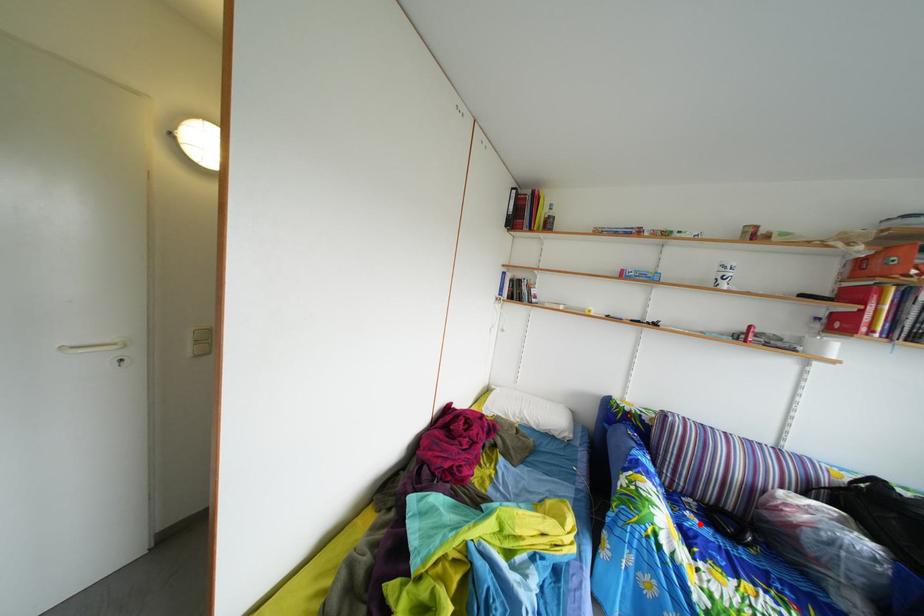
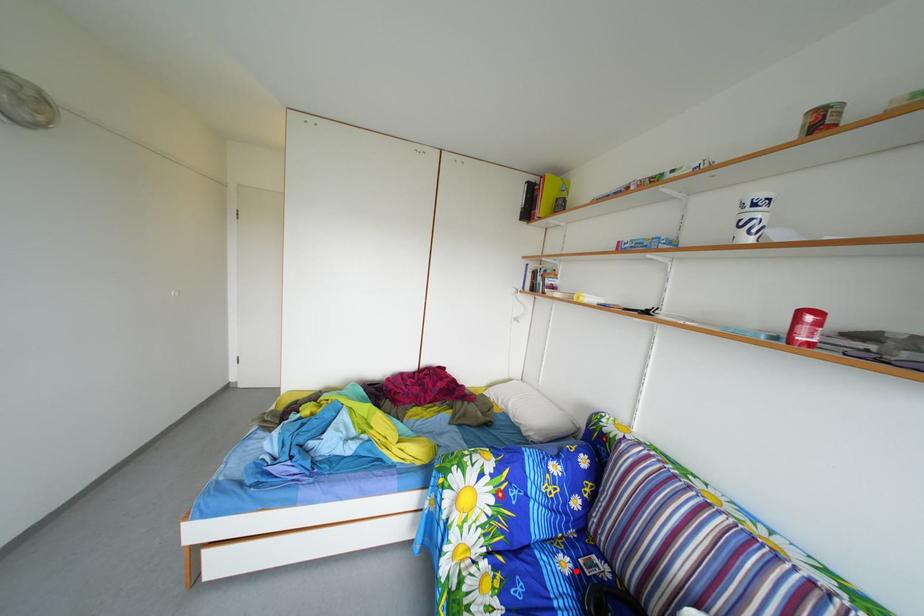
I am providing you with two images of the same scene from different viewpoints. A red point is marked on the first image and another point is marked on the second image. Is the marked point in image1 the same physical position as the marked point in image2?

Yes